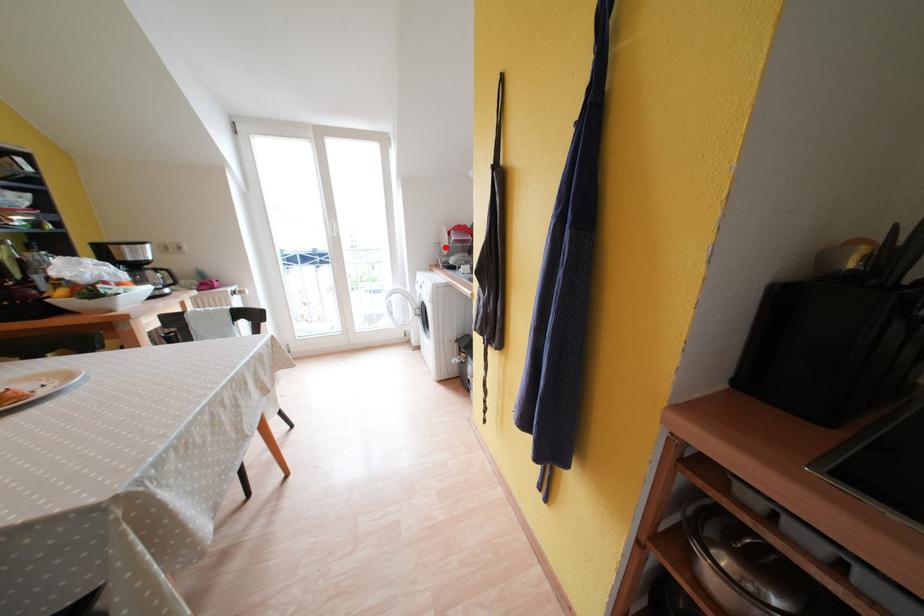
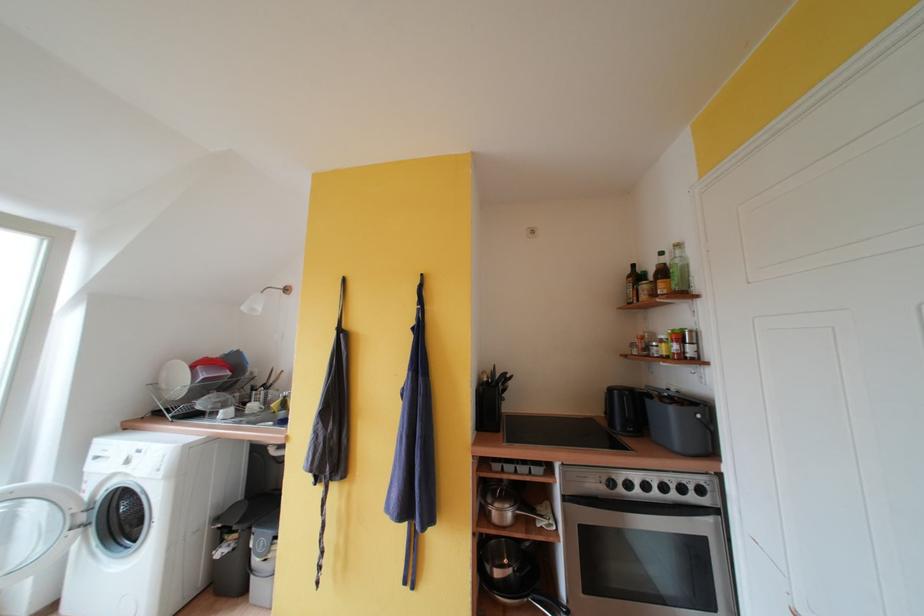
Where in the second image is the point corresponding to the highlighted location from the first image?

(160, 387)